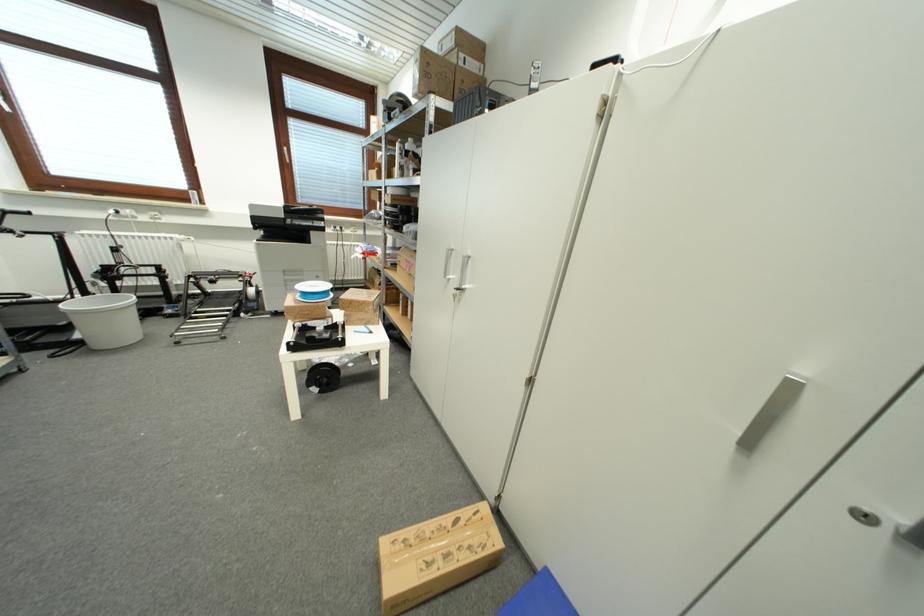
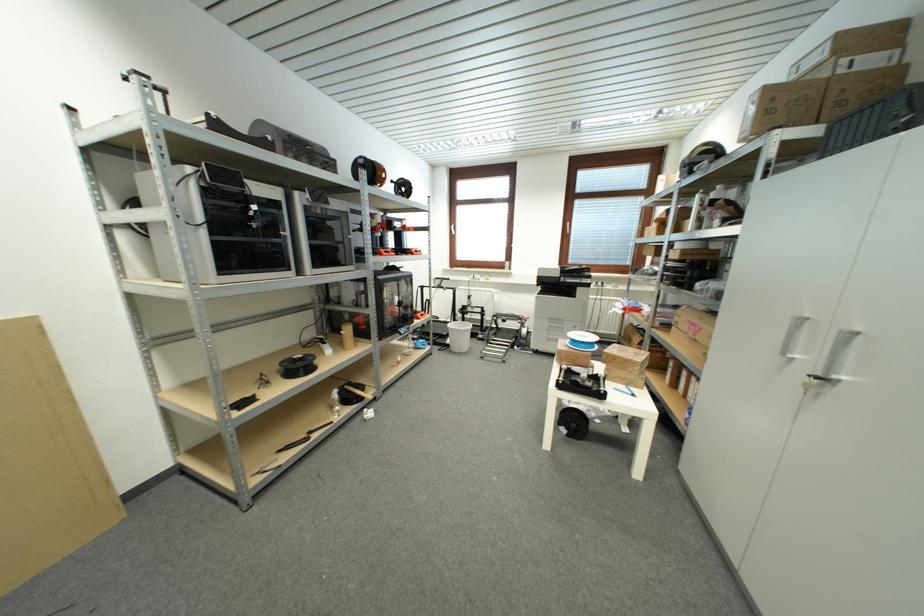
Locate, in the second image, the point that corresponds to (x=411, y=272) in the first image.

(696, 334)